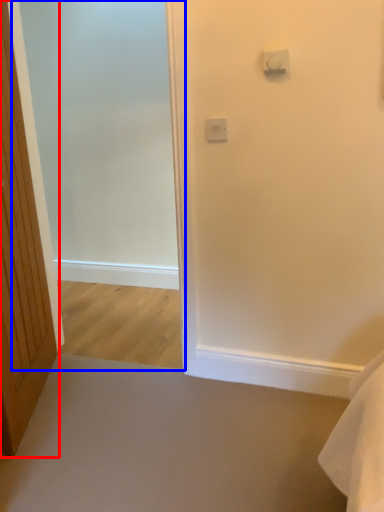
Question: Which of the following is the closest to the observer, door (highlighted by a red box) or screen door (highlighted by a blue box)?

Choices:
 (A) door
 (B) screen door

Answer: (A)